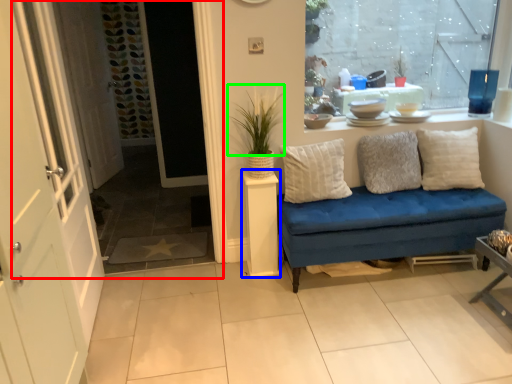
Question: Estimate the real-world distances between objects in this image. Which object is farther from window frame (highlighted by a red box), table (highlighted by a blue box) or plant (highlighted by a green box)?

Choices:
 (A) table
 (B) plant

Answer: (B)